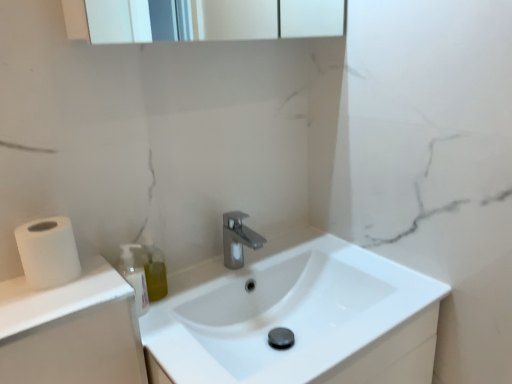
Question: Is translucent plastic soap dispenser at left wider or thinner than satin nickel faucet at center?

Choices:
 (A) wide
 (B) thin

Answer: (B)

Question: In the image, is translucent plastic soap dispenser at left positioned in front of or behind satin nickel faucet at center?

Choices:
 (A) front
 (B) behind

Answer: (A)

Question: Which object is positioned farthest from the white matte toilet paper at left?

Choices:
 (A) white glossy sink at center
 (B) satin nickel faucet at center
 (C) translucent plastic soap dispenser at left

Answer: (A)

Question: Estimate the real-world distances between objects in this image. Which object is farther from the white glossy sink at center?

Choices:
 (A) satin nickel faucet at center
 (B) white matte toilet paper at left
 (C) translucent plastic soap dispenser at left

Answer: (B)